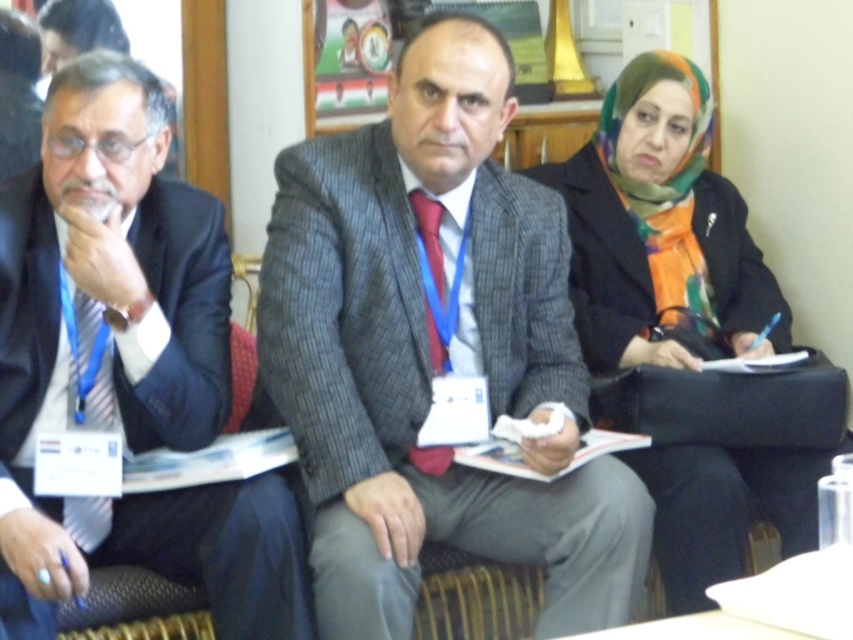
What do you see at coordinates (434, 353) in the screenshot? I see `textured gray suit at center` at bounding box center [434, 353].

Does textured gray suit at center lie in front of multicolored scarf at right?

Yes, it is in front of multicolored scarf at right.

At what (x,y) coordinates should I click in order to perform the action: click on textured gray suit at center. Please return your answer as a coordinate pair (x, y). Looking at the image, I should click on (434, 353).

The width and height of the screenshot is (853, 640). I want to click on textured gray suit at center, so click(434, 353).

Does point (16, 397) lie in front of point (646, 104)?

That is True.

Is the position of matte black suit at left less distant than that of multicolored scarf at right?

Yes, it is.

Where is `matte black suit at left`? The image size is (853, 640). matte black suit at left is located at coordinates (131, 358).

Does textured gray suit at center appear on the left side of matte black suit at left?

No, textured gray suit at center is not to the left of matte black suit at left.

Consider the image. Can you confirm if textured gray suit at center is thinner than matte black suit at left?

Incorrect, textured gray suit at center's width is not less than matte black suit at left's.

The image size is (853, 640). Identify the location of textured gray suit at center. (434, 353).